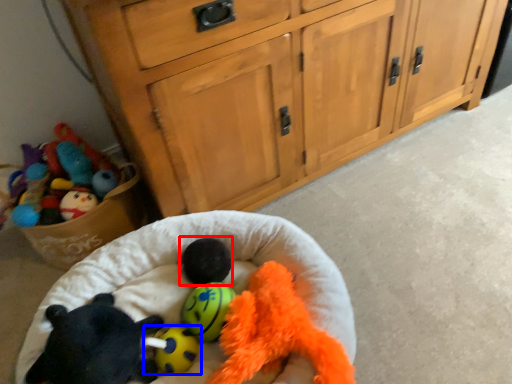
Question: Which object is closer to the camera taking this photo, animal (highlighted by a red box) or toy (highlighted by a blue box)?

Choices:
 (A) animal
 (B) toy

Answer: (B)